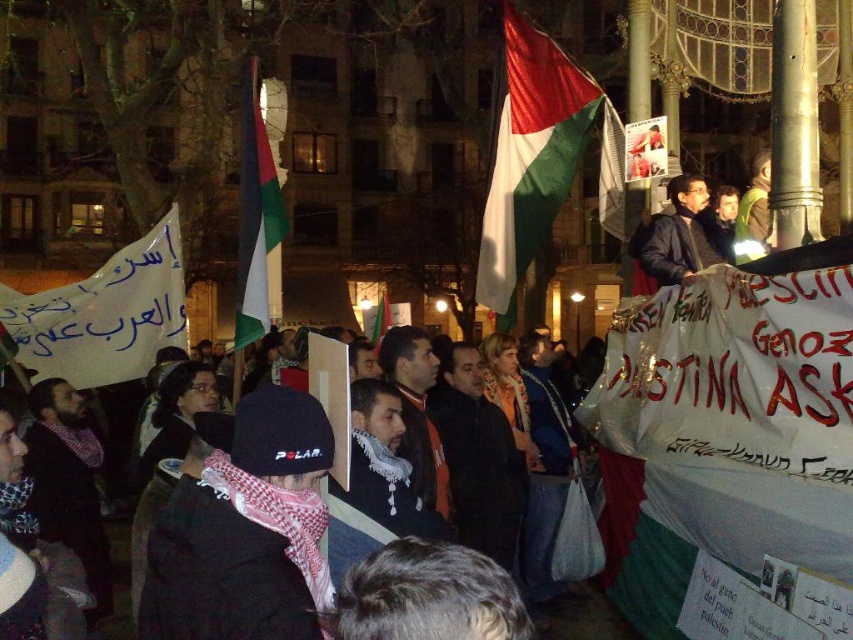
You are a photographer standing at the scene of the nighttime protest. You want to capture a closeup shot of the dark brown leather jacket at upper center. Given that your camera has a maximum focus range of 40 meters, will you be able to focus on the jacket?

The dark brown leather jacket at upper center is 41.77 meters away from the viewer, which exceeds the camera maximum focus range of 40 meters. Therefore, the camera cannot focus on the jacket.

You are a photographer standing at the edge of the protest crowd. You want to capture a photo that includes both the white scarf at center and the green fabric flag at center. Given that your camera has a maximum focus range of 80 feet, will you be able to include both objects in a single focused shot?

The white scarf at center is 80.99 feet away from the green fabric flag at center. Since the distance between them exceeds the camera maximum focus range of 80 feet, you won not be able to capture both objects in a single focused shot.